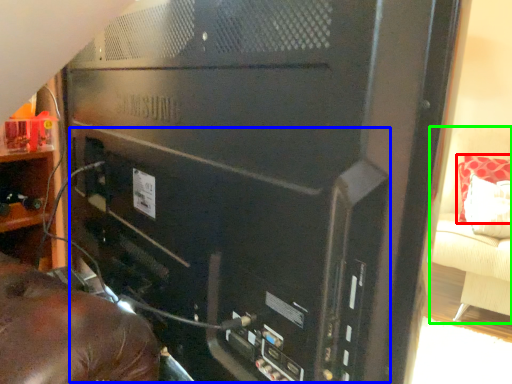
Question: Estimate the real-world distances between objects in this image. Which object is farther from pillow (highlighted by a red box), computer tower (highlighted by a blue box) or furniture (highlighted by a green box)?

Choices:
 (A) computer tower
 (B) furniture

Answer: (A)